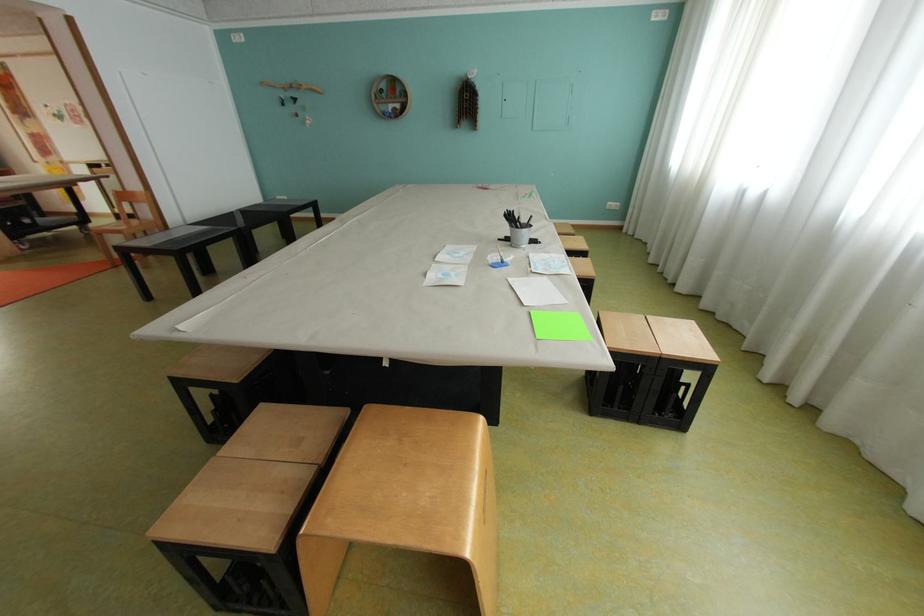
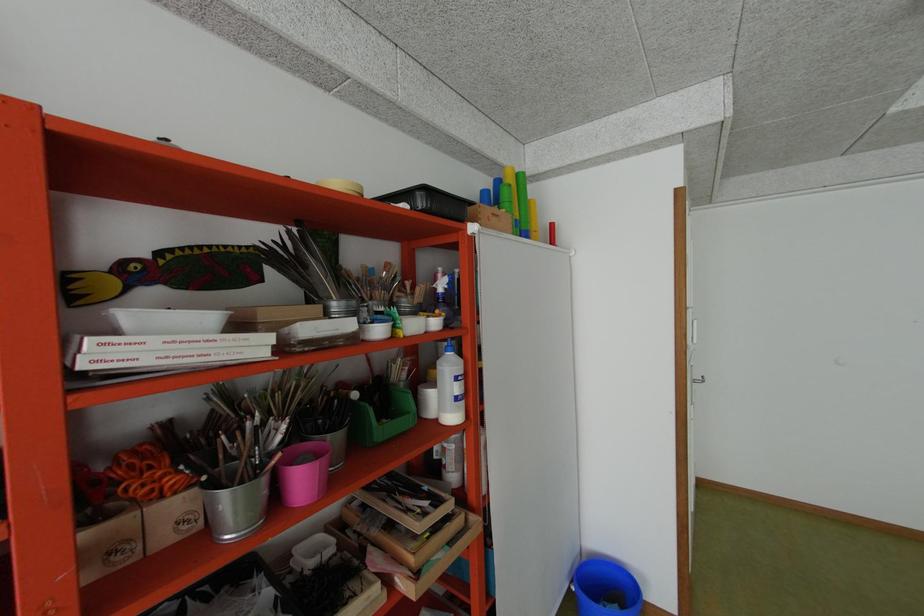
The images are taken continuously from a first-person perspective. In which direction is your viewpoint rotating?

The rotation direction of the camera is left-down.